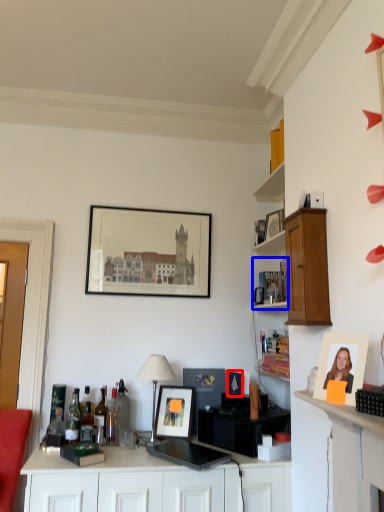
Question: Which point is closer to the camera, picture frame (highlighted by a red box) or shelf (highlighted by a blue box)?

Choices:
 (A) picture frame
 (B) shelf

Answer: (A)